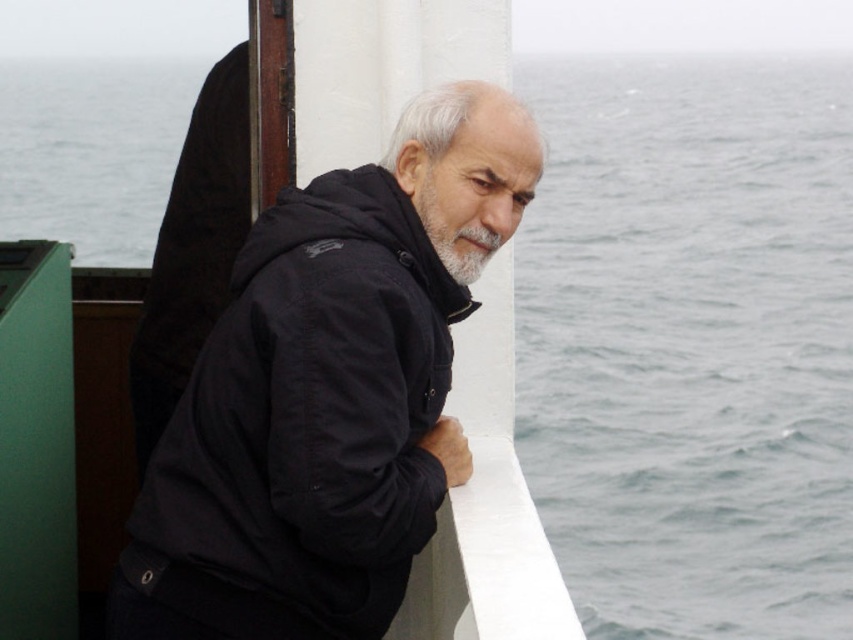
You are a photographer trying to capture the man on the boat. You notice the gray water at upper right and the gray matte beard at center. Which one takes up more space in the image?

The gray water at upper right is larger in size than the gray matte beard at center, so it takes up more space in the image.

You are a fashion designer observing the man in the scene. You need to determine which item of clothing or accessory is bigger between the black fabric jacket at center and the gray matte beard at center. Which one is larger?

The black fabric jacket at center has a larger size compared to the gray matte beard at center, so the black fabric jacket at center is bigger.

You are a sailor on a boat deck. You see the gray water at upper right and the gray matte beard at center. Which object is located to the right side of the other?

Result: The gray water at upper right is located to the right of the gray matte beard at center.